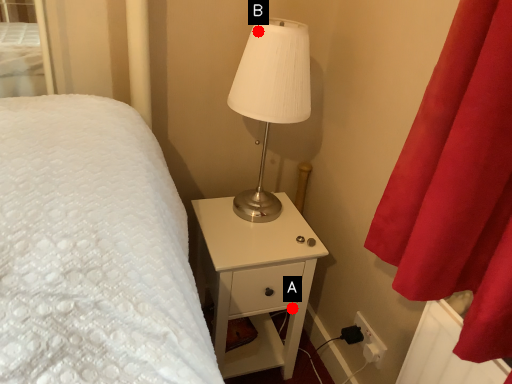
Question: Two points are circled on the image, labeled by A and B beside each circle. Which point appears closest to the camera in this image?

Choices:
 (A) A is closer
 (B) B is closer

Answer: (B)